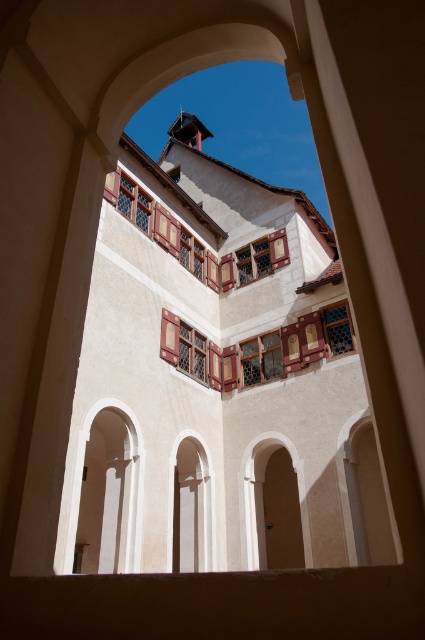
What are the coordinates of the matte glass window at center in the image?

The coordinates of the matte glass window at center are at point [189,349].

You are standing in a courtyard and want to take a photo of the wooden lattice window at center. If your camera can focus on objects up to 100 feet away, will it be able to capture the window clearly?

The wooden lattice window at center is 85.96 feet from camera, so yes, the camera can focus on it clearly since it is within the 100 feet range.

You are an architect designing a new building and want to ensure that the white matte archway at center is proportionate to the matte glass window at center in the courtyard view. Based on the scene description, which object is taller?

The white matte archway at center is much taller than the matte glass window at center according to the description.